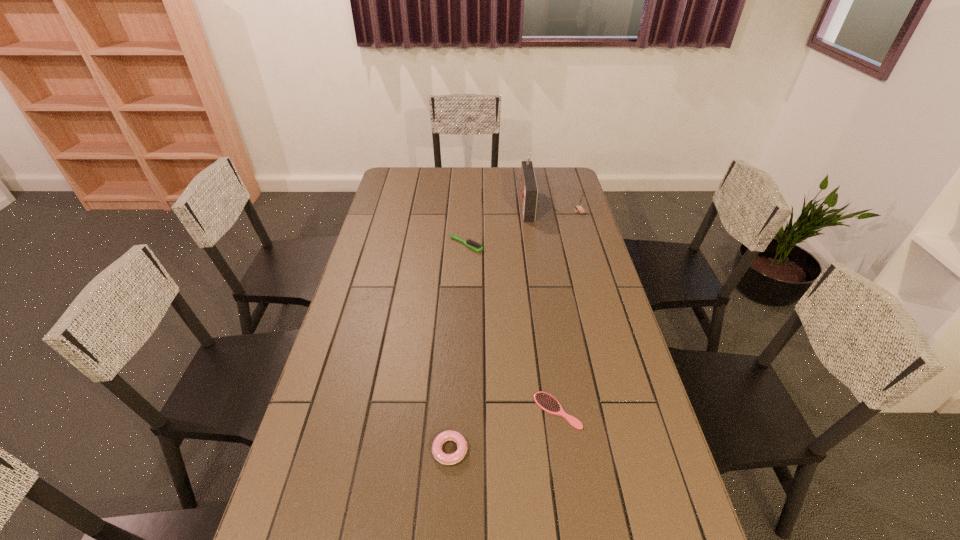
Where is `vacant space that satisfies the following two spatial constraints: 1. on the back side of the nearer hairbrush; 2. on the front panel of the tallest object`? This screenshot has width=960, height=540. vacant space that satisfies the following two spatial constraints: 1. on the back side of the nearer hairbrush; 2. on the front panel of the tallest object is located at coordinates point(527,205).

This screenshot has width=960, height=540. In order to click on vacant space that satisfies the following two spatial constraints: 1. on the front panel of the radio receiver; 2. on the front side of the nearest object in this screenshot , I will do `click(562, 450)`.